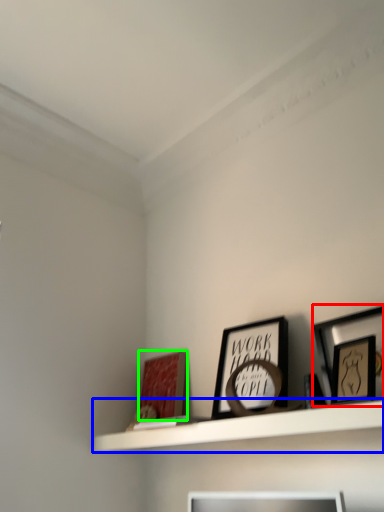
Question: Which object is the farthest from picture frame (highlighted by a red box)? Choose among these: shelf (highlighted by a blue box) or picture frame (highlighted by a green box).

Choices:
 (A) shelf
 (B) picture frame

Answer: (B)